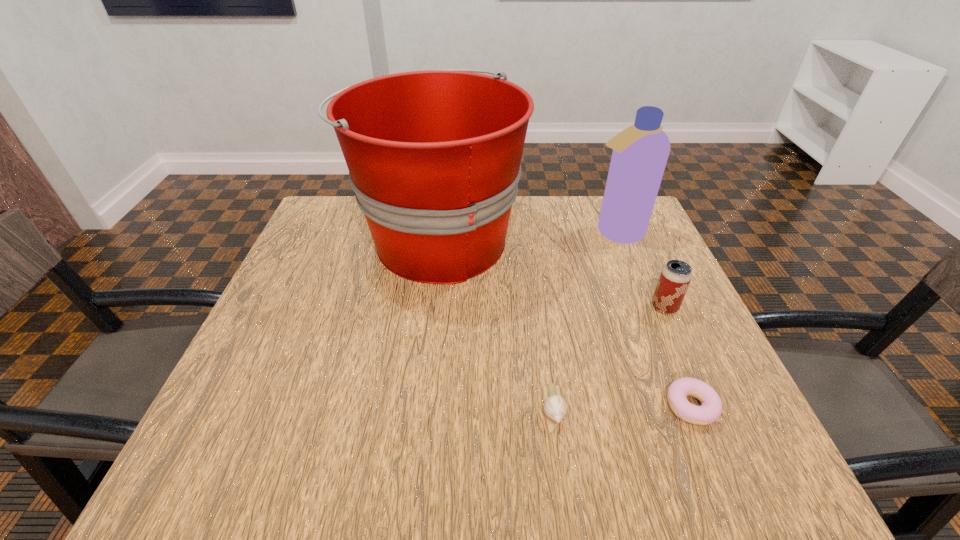
Identify the location of vacant area that lies between the shampoo and the beer can. (640, 270).

I want to click on vacant space that's between the bucket and the escargot, so click(x=495, y=323).

At what (x,y) coordinates should I click in order to perform the action: click on free space that is in between the shortest object and the bucket. Please return your answer as a coordinate pair (x, y). Image resolution: width=960 pixels, height=540 pixels. Looking at the image, I should click on (564, 323).

What are the coordinates of `vacant area that lies between the escargot and the third tallest object` in the screenshot? It's located at pos(609,357).

Where is `free space between the shortest object and the escargot`? free space between the shortest object and the escargot is located at coordinates (622, 407).

Where is `free space between the escargot and the beer can`? free space between the escargot and the beer can is located at coordinates (609, 357).

The width and height of the screenshot is (960, 540). Identify the location of object that ranks as the second closest to the escargot. (434, 157).

Locate an element on the screen. The width and height of the screenshot is (960, 540). object that can be found as the third closest to the fourth tallest object is located at coordinates (675, 277).

Locate an element on the screen. Image resolution: width=960 pixels, height=540 pixels. vacant region that satisfies the following two spatial constraints: 1. on the front side of the bucket; 2. on the left side of the doughnut is located at coordinates (418, 407).

In order to click on vacant region that satisfies the following two spatial constraints: 1. on the front side of the shampoo; 2. on the right side of the shortest object in this screenshot , I will do `click(684, 407)`.